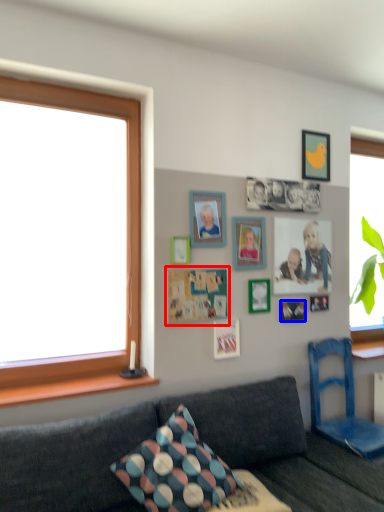
Question: Among these objects, which one is farthest to the camera, bulletin board (highlighted by a red box) or decorative picture (highlighted by a blue box)?

Choices:
 (A) bulletin board
 (B) decorative picture

Answer: (B)